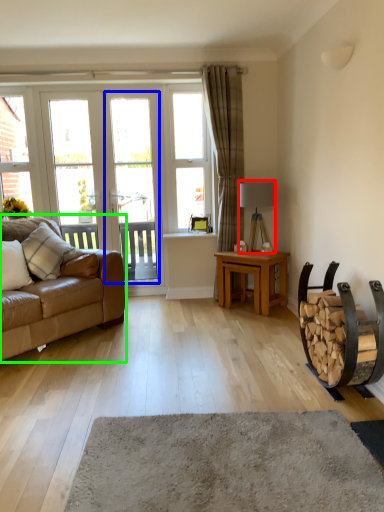
Question: Which object is positioned farthest from lamp (highlighted by a red box)? Select from screen door (highlighted by a blue box) and studio couch (highlighted by a green box).

Choices:
 (A) screen door
 (B) studio couch

Answer: (B)